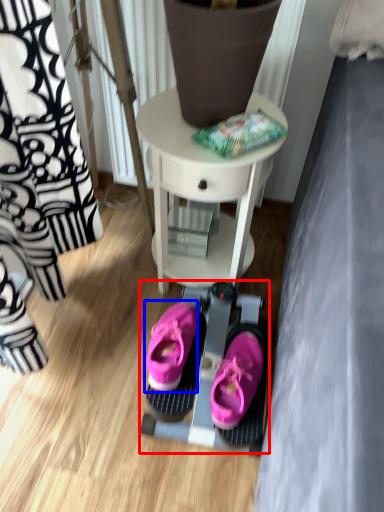
Question: Which object appears farthest to the camera in this image, bunk bed (highlighted by a red box) or footwear (highlighted by a blue box)?

Choices:
 (A) bunk bed
 (B) footwear

Answer: (A)